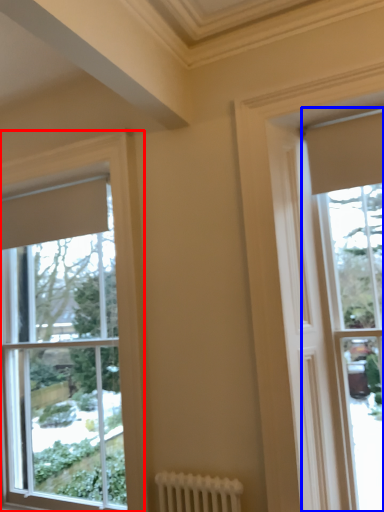
Question: Which point is further to the camera, window (highlighted by a red box) or window (highlighted by a blue box)?

Choices:
 (A) window
 (B) window

Answer: (A)